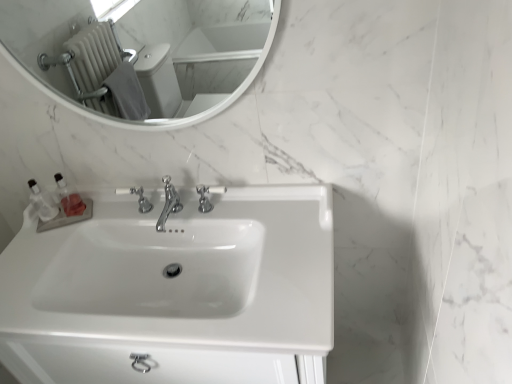
The height and width of the screenshot is (384, 512). What are the coordinates of `free space in front of clear plastic bottles at left, which is the second toiletry from left to right` in the screenshot? It's located at (45, 248).